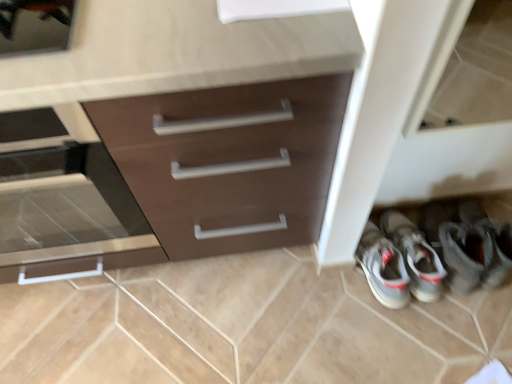
You are a GUI agent. You are given a task and a screenshot of the screen. Output one action in this format:
    pyautogui.click(x=<x>, y=<y>)
    Task: Click on the vacant region in front of gray fabric sneakers at lower right
    This screenshot has height=384, width=512.
    Given the screenshot: What is the action you would take?
    pyautogui.click(x=410, y=343)